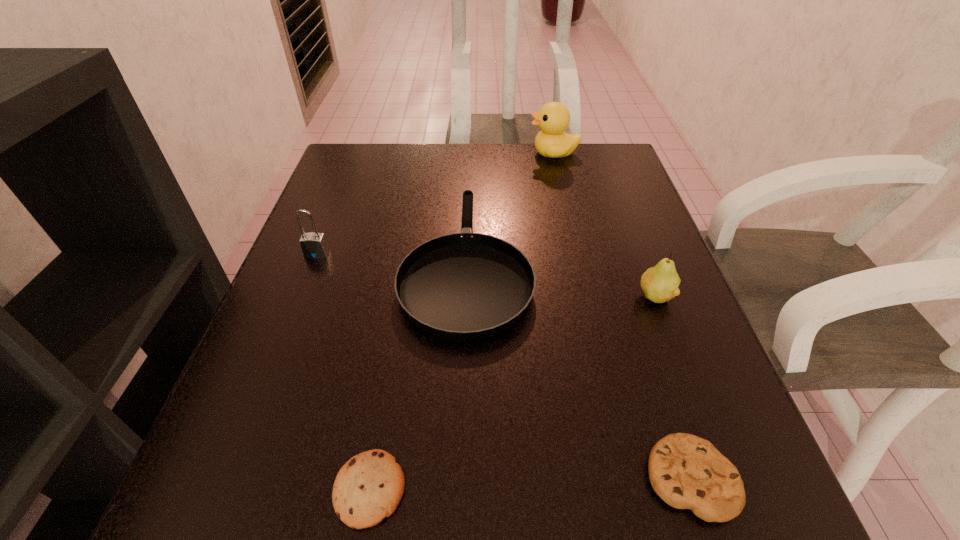
This screenshot has height=540, width=960. I want to click on object at the left edge, so 313,245.

Locate an element on the screen. This screenshot has width=960, height=540. duck located in the right edge section of the desktop is located at coordinates 553,118.

You are a GUI agent. You are given a task and a screenshot of the screen. Output one action in this format:
    pyautogui.click(x=<x>, y=<y>)
    Task: Click on the pear present at the right edge
    
    Given the screenshot: What is the action you would take?
    pyautogui.click(x=660, y=283)

You are a GUI agent. You are given a task and a screenshot of the screen. Output one action in this format:
    pyautogui.click(x=<x>, y=<y>)
    Task: Click on the cookie positioned at the right edge
    This screenshot has height=540, width=960.
    Given the screenshot: What is the action you would take?
    pyautogui.click(x=686, y=471)

At what (x,y) coordinates should I click in order to perform the action: click on object at the far right corner. Please return your answer as a coordinate pair (x, y). This screenshot has width=960, height=540. Looking at the image, I should click on (553, 118).

Locate an element on the screen. Image resolution: width=960 pixels, height=540 pixels. object that is at the near right corner is located at coordinates (686, 471).

Locate an element on the screen. free region at the far edge is located at coordinates (480, 185).

Find the location of a particular element. free location at the left edge of the desktop is located at coordinates (321, 382).

You are a GUI agent. You are given a task and a screenshot of the screen. Output one action in this format:
    pyautogui.click(x=<x>, y=<y>)
    Task: Click on the free spot at the right edge of the desktop
    This screenshot has width=960, height=540.
    Given the screenshot: What is the action you would take?
    pyautogui.click(x=636, y=318)

In the image, there is a desktop. Identify the location of free region at the near left corner. The image size is (960, 540). (247, 497).